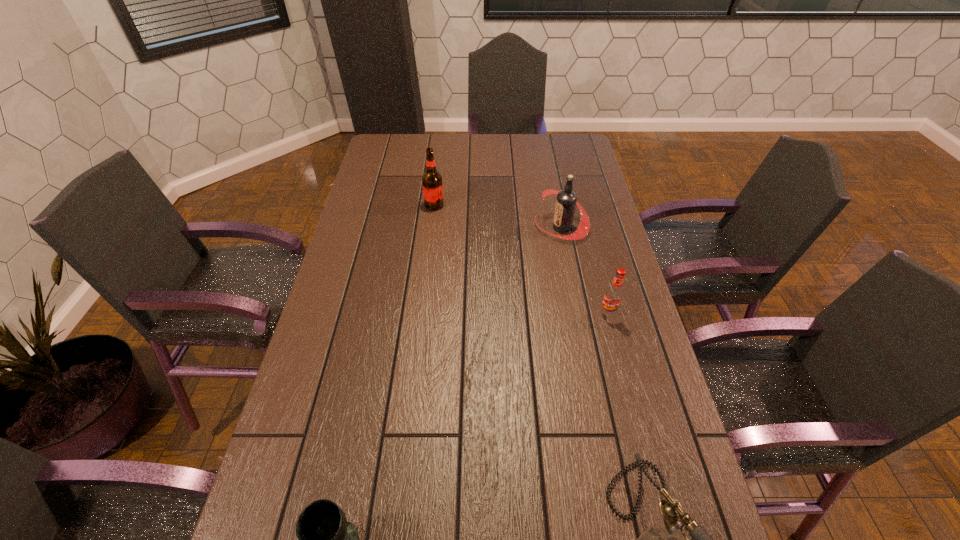
Locate an element on the screen. free space at the far edge is located at coordinates (456, 153).

Image resolution: width=960 pixels, height=540 pixels. Identify the location of vacant space at the left edge. (395, 179).

Identify the location of vacant region at the right edge of the desktop. The width and height of the screenshot is (960, 540). (577, 169).

Locate an element on the screen. vacant region at the far right corner of the desktop is located at coordinates (559, 142).

Find the location of a particular element. The width and height of the screenshot is (960, 540). free space between the second farthest root beer and the farthest root beer is located at coordinates (498, 216).

I want to click on free space between the shortest root beer and the second farthest object, so click(x=585, y=271).

Find the location of a particular element. object that can be found as the third closest to the nearest root beer is located at coordinates (432, 186).

Identify the location of the third closest object to the telephone. (566, 201).

Identify which root beer is the third closest to the telephone. Please provide its 2D coordinates. Your answer should be formatted as a tuple, i.e. [(x, y)], where the tuple contains the x and y coordinates of a point satisfying the conditions above.

[(432, 186)]

The width and height of the screenshot is (960, 540). What are the coordinates of `root beer that is the closest to the chalice` in the screenshot? It's located at (613, 296).